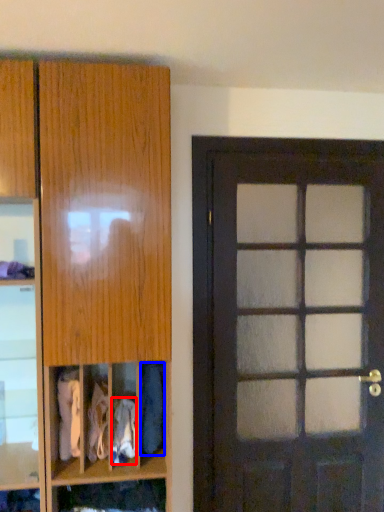
Question: Which object appears closest to the camera in this image, clothing (highlighted by a red box) or clothing (highlighted by a blue box)?

Choices:
 (A) clothing
 (B) clothing

Answer: (A)